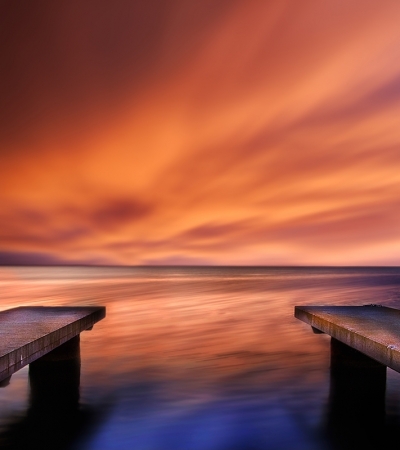
The width and height of the screenshot is (400, 450). Find the location of `artwork`. artwork is located at coordinates (260, 225).